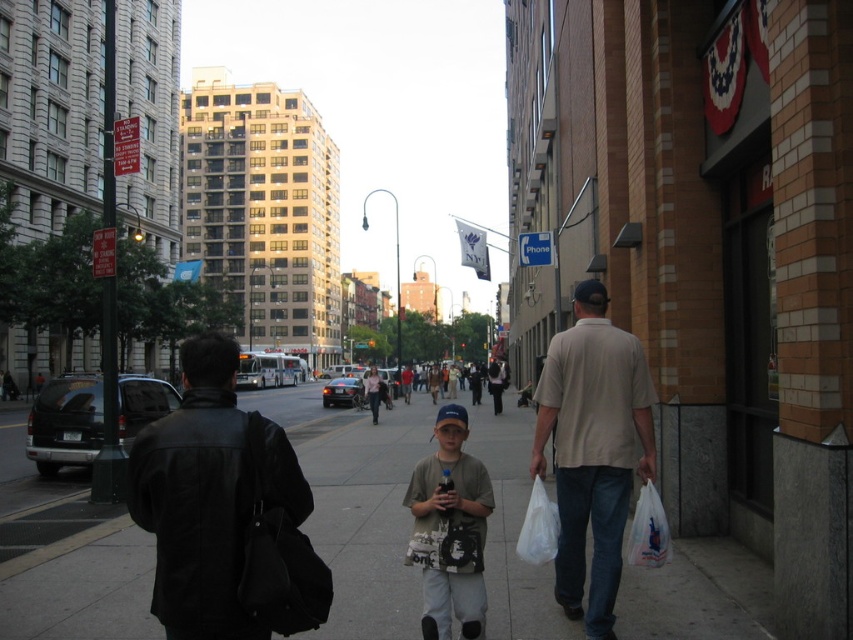
You are a pedestrian standing on the smooth concrete sidewalk at center and want to see the beige cotton shirt at right. Can you see it without moving your head?

The beige cotton shirt at right is behind the smooth concrete sidewalk at center, so you cannot see it without moving your head.

You are a photographer standing at the center of the urban street scene. You want to capture a photo that includes both the point at coordinates point (392, 616) and the point at coordinates point (589, 589). Which point should you focus on first to ensure both are in sharp focus?

You should focus on point (392, 616) first because it is closer to the camera than point (589, 589). This way, the depth of field will likely cover both points when focusing on the closer one.

You are a delivery person standing on the smooth concrete sidewalk at center and need to hand a package to the person wearing the light gray cotton shirt at center. Can you reach them without moving from your current position?

The smooth concrete sidewalk at center is further to the viewer than light gray cotton shirt at center, meaning the sidewalk is closer to you. Since the sidewalk is closer, the person wearing the light gray cotton shirt at center is farther away, so you cannot reach them without moving.